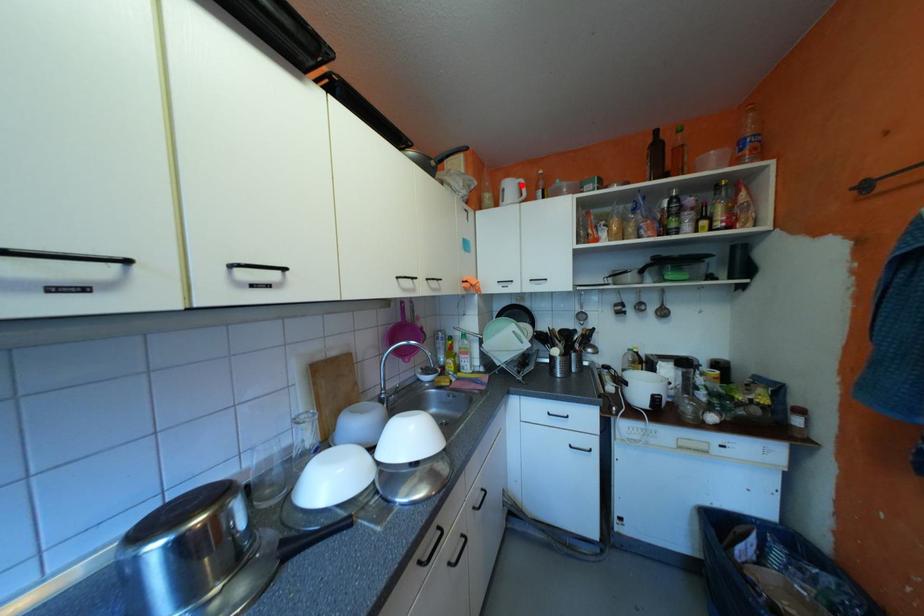
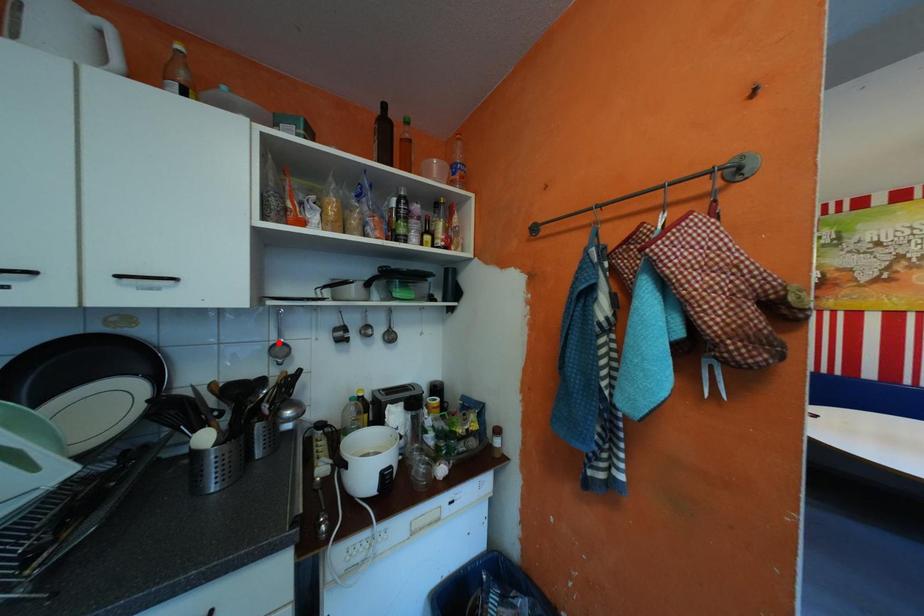
I am providing you with two images of the same scene from different viewpoints. A red point is marked on the first image and another point is marked on the second image. Is the red point in image1 aligned with the point shown in image2?

No